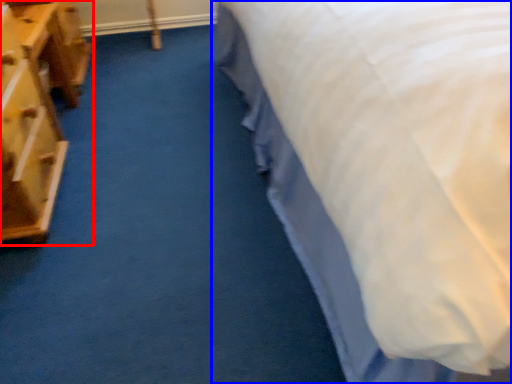
Question: Which of the following is the closest to the observer, furniture (highlighted by a red box) or bed (highlighted by a blue box)?

Choices:
 (A) furniture
 (B) bed

Answer: (B)